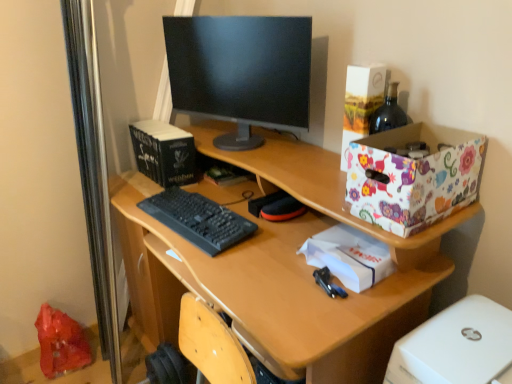
Locate an element on the screen. This screenshot has width=512, height=384. free spot to the left of floral paper box at upper right is located at coordinates (306, 172).